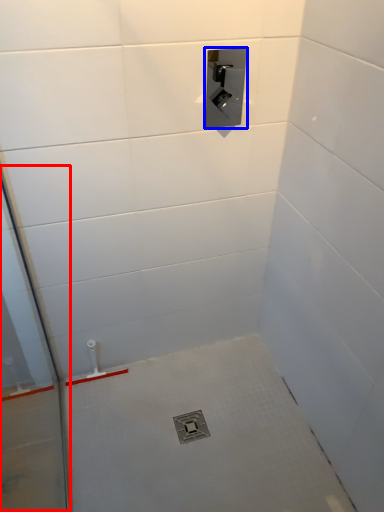
Question: Among these objects, which one is nearest to the camera, glass door (highlighted by a red box) or plumbing fixture (highlighted by a blue box)?

Choices:
 (A) glass door
 (B) plumbing fixture

Answer: (A)